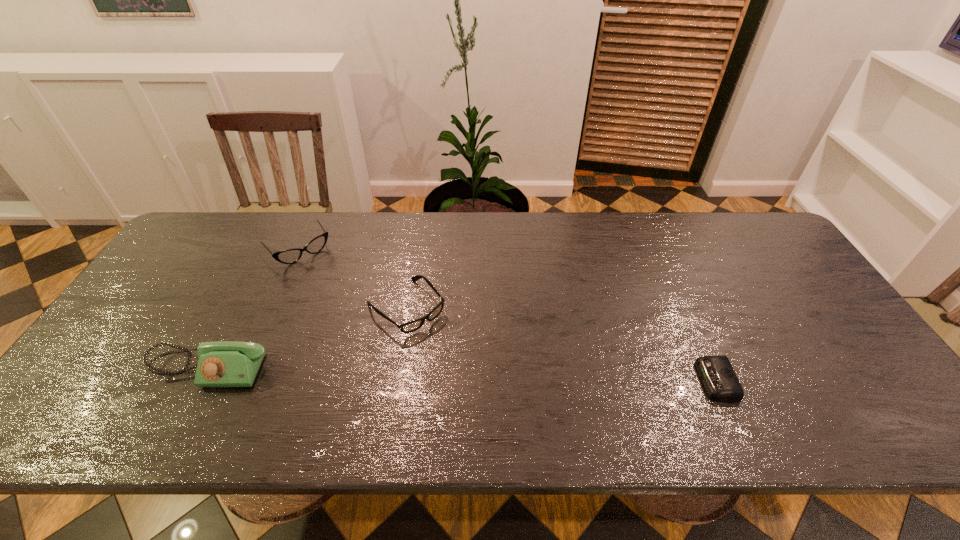
Locate an element on the screen. Image resolution: width=960 pixels, height=540 pixels. free space between the left spectacles and the tallest object is located at coordinates point(253,309).

The image size is (960, 540). In order to click on vacant space that's between the taller spectacles and the shortest object in this screenshot , I will do `click(508, 315)`.

I want to click on vacant space that's between the rightmost object and the tallest object, so click(x=462, y=375).

This screenshot has height=540, width=960. Find the location of `vacant region between the tallest object and the rightmost object`. vacant region between the tallest object and the rightmost object is located at coordinates (462, 375).

You are a GUI agent. You are given a task and a screenshot of the screen. Output one action in this format:
    pyautogui.click(x=<x>, y=<y>)
    Task: Click on the empty space between the tallest object and the third shortest object
    This screenshot has width=960, height=540.
    Given the screenshot: What is the action you would take?
    pyautogui.click(x=253, y=309)

The width and height of the screenshot is (960, 540). Find the location of `vacant area that lies between the third shortest object and the tallest object`. vacant area that lies between the third shortest object and the tallest object is located at coordinates pos(253,309).

Where is `vacant space that's between the second object from right to left and the rightmost object`? This screenshot has height=540, width=960. vacant space that's between the second object from right to left and the rightmost object is located at coordinates (561, 344).

Image resolution: width=960 pixels, height=540 pixels. I want to click on the third closest object relative to the taller spectacles, so click(716, 372).

Identify the location of object that is the second closest to the tallest object. (289, 256).

Where is `vacant space that satisfies the following two spatial constraints: 1. on the dial of the tallest object; 2. on the display of the shortest object`? The image size is (960, 540). vacant space that satisfies the following two spatial constraints: 1. on the dial of the tallest object; 2. on the display of the shortest object is located at coordinates (201, 381).